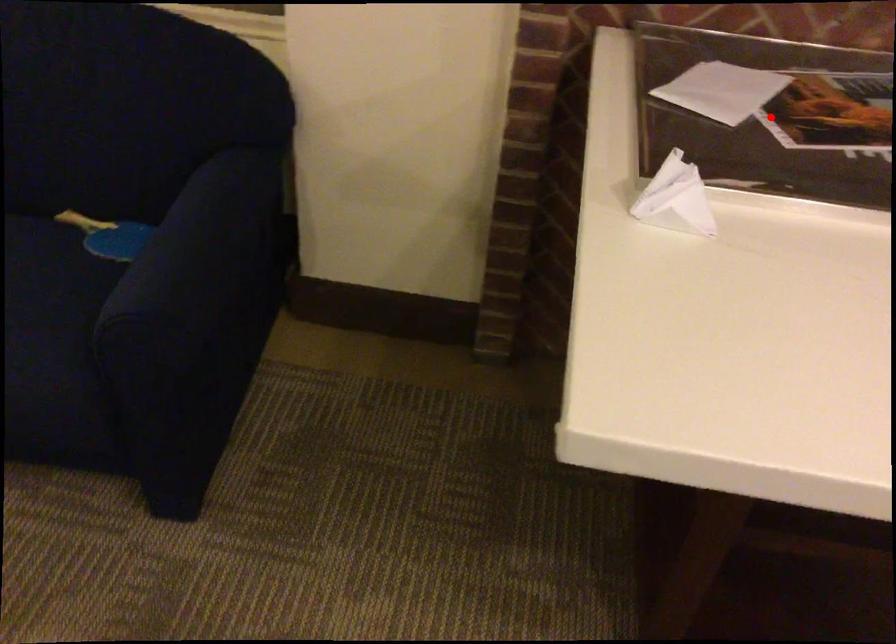
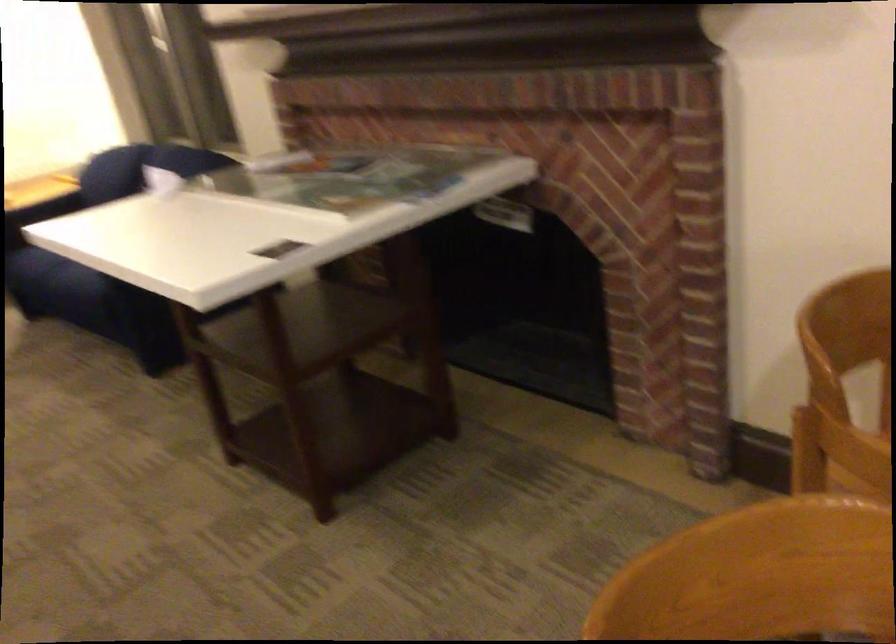
Question: I am providing you with two images of the same scene from different viewpoints. A red point is marked on the first image. Can you still see the location of the red point in image 2?

Choices:
 (A) Yes
 (B) No

Answer: (B)